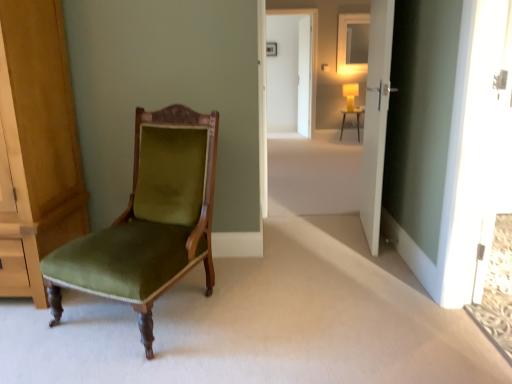
Question: Is matte yellow lampshade at center beside matte white desk at center?

Choices:
 (A) no
 (B) yes

Answer: (A)

Question: Considering the relative sizes of matte yellow lampshade at center and matte white desk at center in the image provided, is matte yellow lampshade at center shorter than matte white desk at center?

Choices:
 (A) yes
 (B) no

Answer: (B)

Question: From a real-world perspective, is matte yellow lampshade at center physically below matte white desk at center?

Choices:
 (A) yes
 (B) no

Answer: (B)

Question: Does matte yellow lampshade at center have a greater height compared to matte white desk at center?

Choices:
 (A) yes
 (B) no

Answer: (A)

Question: Is matte yellow lampshade at center smaller than matte white desk at center?

Choices:
 (A) no
 (B) yes

Answer: (A)

Question: Is point (370, 54) positioned closer to the camera than point (345, 41)?

Choices:
 (A) closer
 (B) farther

Answer: (A)

Question: From the image's perspective, relative to matte white mirror at upper center, is matte yellow lampshade at center above or below?

Choices:
 (A) above
 (B) below

Answer: (B)

Question: Would you say matte yellow lampshade at center is inside or outside matte white mirror at upper center?

Choices:
 (A) inside
 (B) outside

Answer: (B)

Question: From a real-world perspective, is matte yellow lampshade at center physically located above or below matte white mirror at upper center?

Choices:
 (A) above
 (B) below

Answer: (B)

Question: From the image's perspective, relative to matte white mirror at upper center, is velvet green chair at left above or below?

Choices:
 (A) below
 (B) above

Answer: (A)

Question: Which is correct: velvet green chair at left is inside matte white mirror at upper center, or outside of it?

Choices:
 (A) inside
 (B) outside

Answer: (B)

Question: Is velvet green chair at left wider or thinner than matte white mirror at upper center?

Choices:
 (A) thin
 (B) wide

Answer: (B)

Question: From a real-world perspective, relative to matte white mirror at upper center, is velvet green chair at left vertically above or below?

Choices:
 (A) above
 (B) below

Answer: (B)

Question: From a real-world perspective, is white matte door at center, the first door when ordered from front to back, positioned above or below matte white desk at center?

Choices:
 (A) below
 (B) above

Answer: (B)

Question: In terms of width, does white matte door at center, the 2th door viewed from the back, look wider or thinner when compared to matte white desk at center?

Choices:
 (A) thin
 (B) wide

Answer: (A)